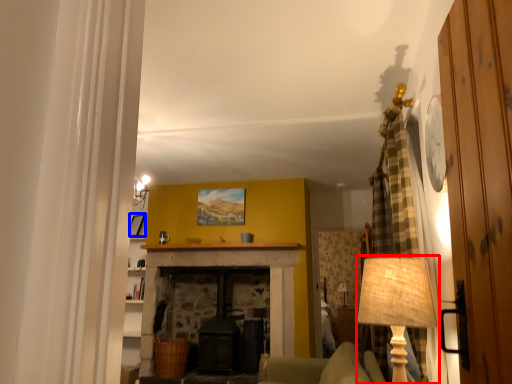
Question: Which object is closer to the camera taking this photo, table lamp (highlighted by a red box) or picture frame (highlighted by a blue box)?

Choices:
 (A) table lamp
 (B) picture frame

Answer: (A)